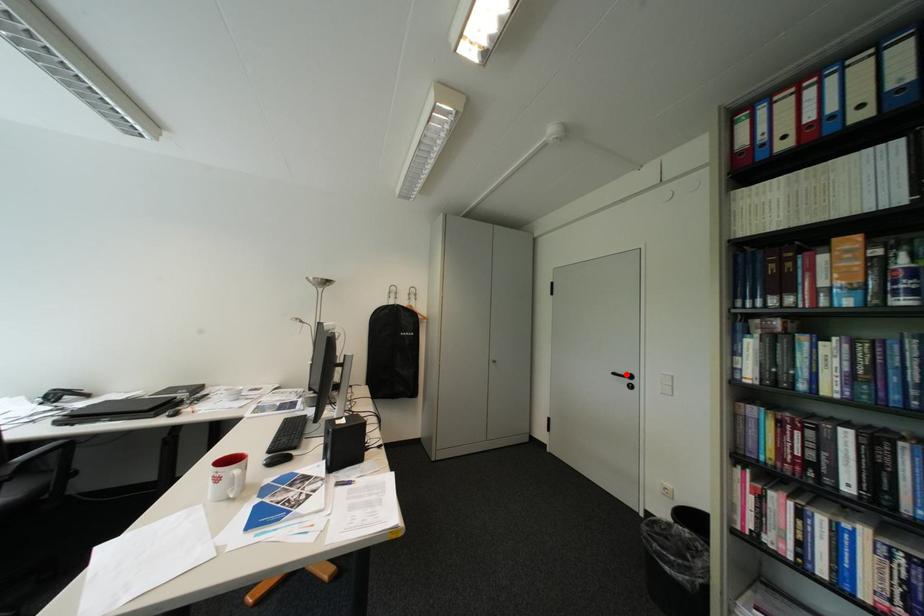
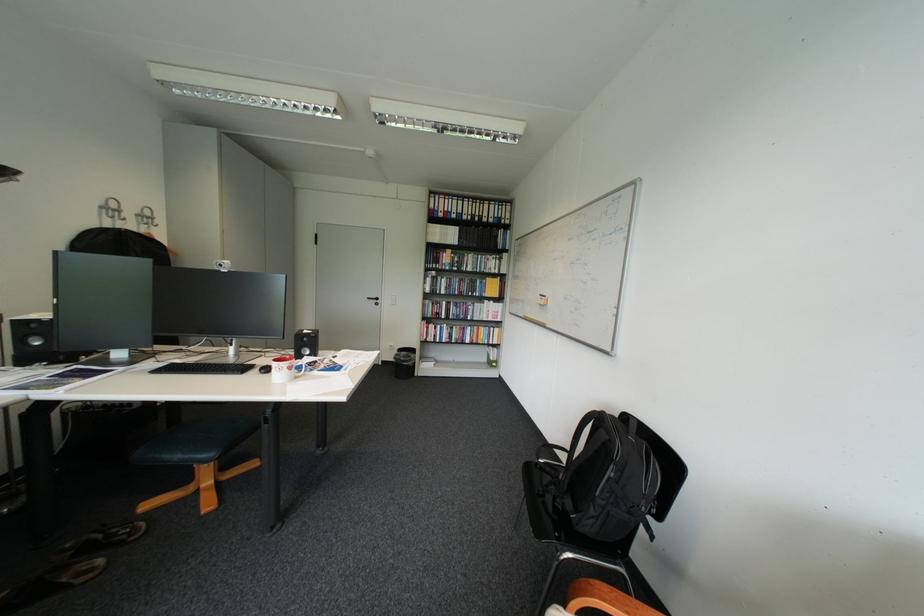
In the second image, find the point that corresponds to the highlighted location in the first image.

(381, 299)